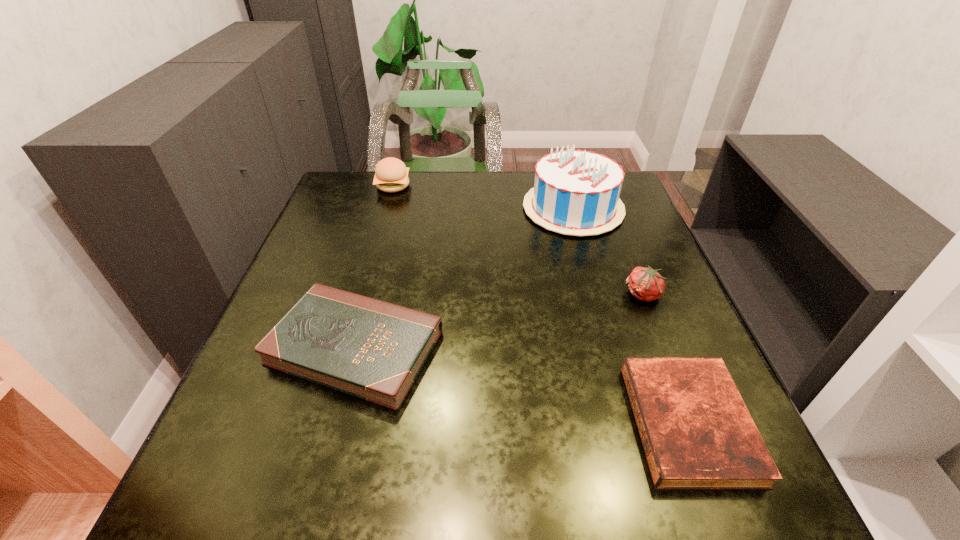
This screenshot has height=540, width=960. Find the location of `the tallest object`. the tallest object is located at coordinates (576, 192).

Where is `the second tallest object`? The image size is (960, 540). the second tallest object is located at coordinates (391, 175).

Where is `tomato`? tomato is located at coordinates (646, 284).

What are the coordinates of `the second shortest object` in the screenshot? It's located at (374, 350).

Locate an element on the screen. the left Bible is located at coordinates (374, 350).

Where is `the shortest object`? The image size is (960, 540). the shortest object is located at coordinates (697, 433).

This screenshot has width=960, height=540. I want to click on the right Bible, so (697, 433).

I want to click on vacant space located 0.050m on the back of the tallest object, so click(x=564, y=174).

The width and height of the screenshot is (960, 540). Identify the location of vacant space located 0.150m on the right of the hamburger. (460, 186).

This screenshot has width=960, height=540. What are the coordinates of `free space located on the back of the tomato` in the screenshot? It's located at (603, 192).